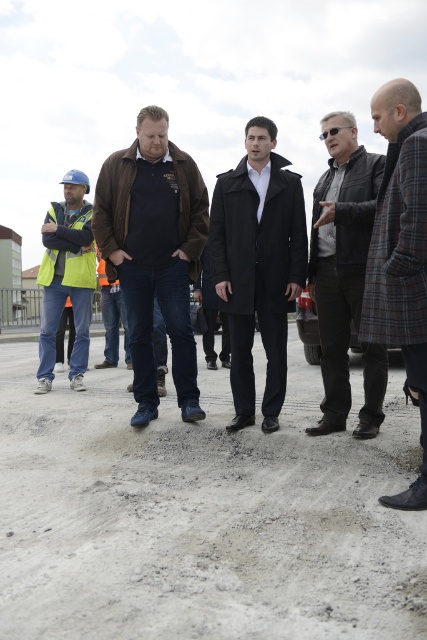
Question: Which object is the closest to the brown leather jacket at center?

Choices:
 (A) plaid wool coat at right
 (B) black wool coat at center
 (C) gray gravel at center
 (D) leather jacket at center

Answer: (B)

Question: Is plaid wool coat at right wider than high visibility yellow vest at left?

Choices:
 (A) yes
 (B) no

Answer: (B)

Question: Which of the following is the farthest from the observer?

Choices:
 (A) high visibility yellow vest at left
 (B) black wool coat at center
 (C) plaid wool coat at right

Answer: (A)

Question: Is black wool coat at center smaller than plaid wool coat at right?

Choices:
 (A) no
 (B) yes

Answer: (A)

Question: Is black wool coat at center bigger than leather jacket at center?

Choices:
 (A) yes
 (B) no

Answer: (B)

Question: Which object appears closest to the camera in this image?

Choices:
 (A) plaid wool coat at right
 (B) black wool coat at center

Answer: (A)